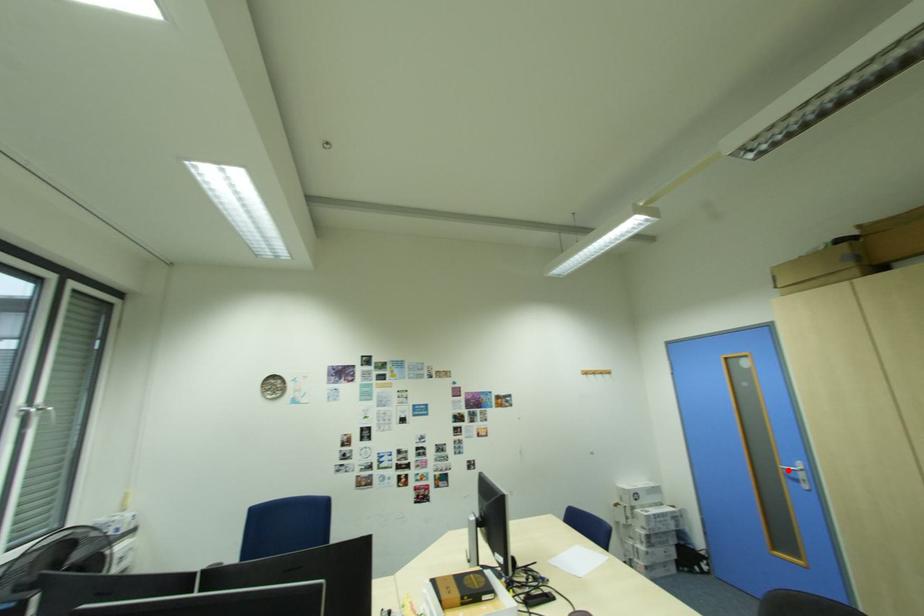
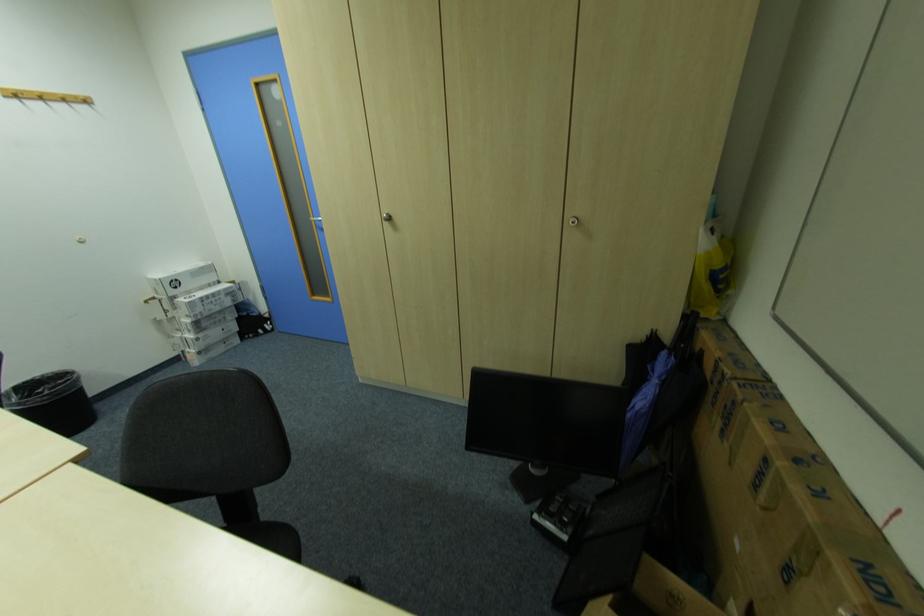
Locate, in the second image, the point that corresponds to the highlighted location in the first image.

(322, 225)